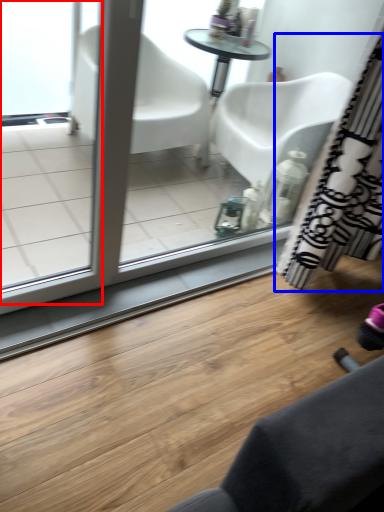
Question: Which point is further to the camera, screen door (highlighted by a red box) or curtain (highlighted by a blue box)?

Choices:
 (A) screen door
 (B) curtain

Answer: (B)